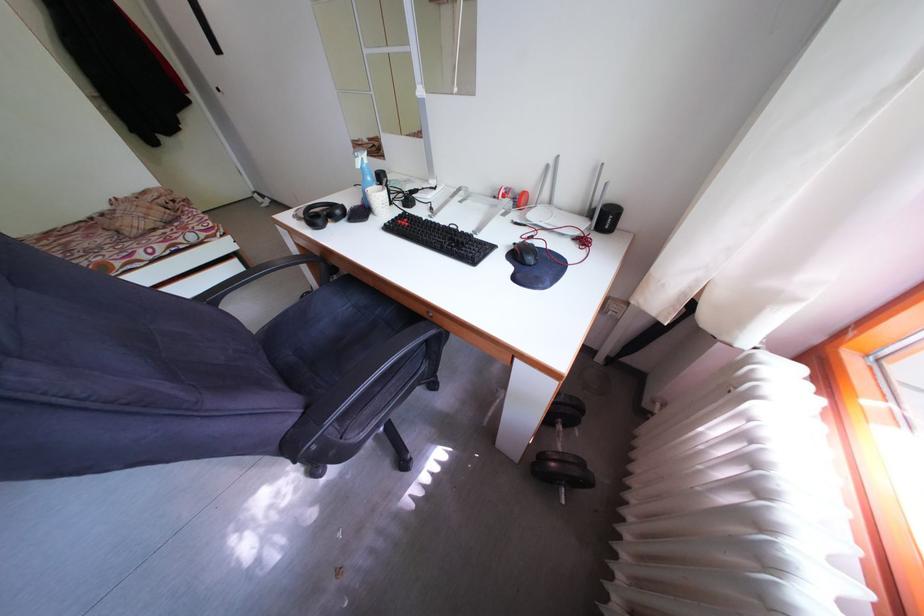
Find the location of a particular element. chair sitting surface is located at coordinates (334, 330).